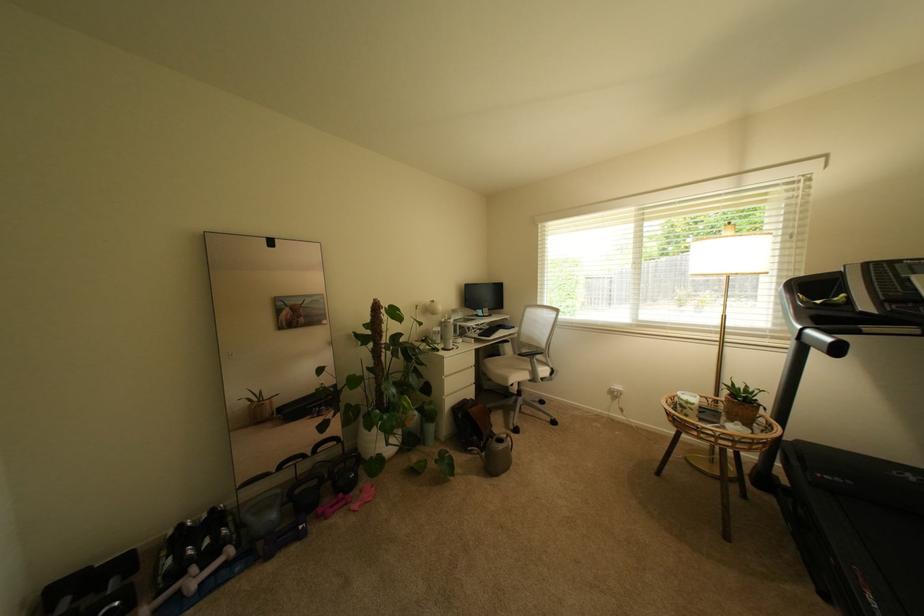
You are a GUI agent. You are given a task and a screenshot of the screen. Output one action in this format:
    pyautogui.click(x=<x>, y=<y>)
    Task: Click on the yellow banana
    
    Given the screenshot: What is the action you would take?
    pos(825,300)